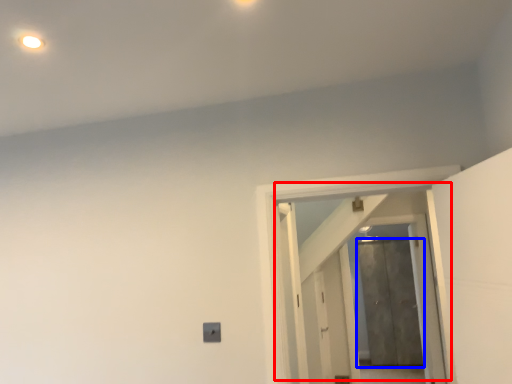
Question: Which point is closer to the camera, door (highlighted by a red box) or door (highlighted by a blue box)?

Choices:
 (A) door
 (B) door

Answer: (A)